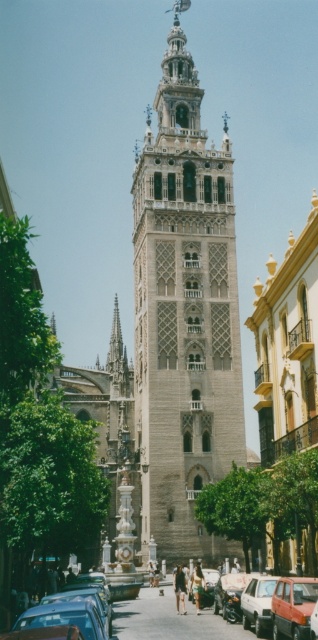
You are a photographer planning to capture the Gothic tower in the background with both the matte blue sedan at lower left and the matte red car at center in the frame. Which car should you position closer to the tower to ensure both fit in the shot without overlapping?

The matte blue sedan at lower left is wider than the matte red car at center. To fit both cars in the frame without overlapping, position the wider matte blue sedan at lower left closer to the tower so that its larger size can be accommodated within the shot.

Based on the photo, you are standing in the city square and see a matte silver car at center. There is a point marked at coordinate (257, 604). Where is this point located on the matte silver car at center?

The point at coordinate (257, 604) is located on the matte silver car at center.

Consider the image. You are a photographer planning to take a photo of both the matte silver car at center and the matte red car at center. You want to ensure that both cars are fully visible in the frame without any part being cut off. Which car requires you to adjust your camera angle to a higher position to capture its full height?

The matte silver car at center is much taller than the matte red car at center, so you need to adjust your camera angle to a higher position to capture the full height of the matte silver car at center.